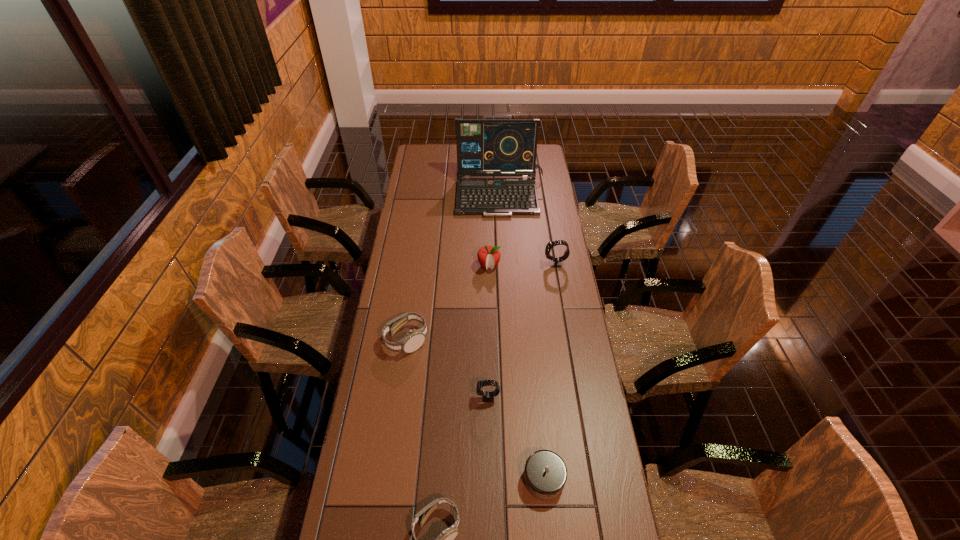
Find the location of a particular element. Image resolution: width=960 pixels, height=540 pixels. the tallest object is located at coordinates (0, 0).

Identify the location of laptop computer. (0, 0).

Locate an element on the screen. The height and width of the screenshot is (540, 960). the biggest gray watch is located at coordinates (0, 0).

At what (x,y) coordinates should I click in order to perform the action: click on the farthest watch. Please return your answer as a coordinate pair (x, y). Looking at the image, I should click on [0, 0].

This screenshot has width=960, height=540. I want to click on the rightmost watch, so click(0, 0).

Where is `the second farthest watch`? the second farthest watch is located at coordinates pos(0,0).

I want to click on apple, so click(x=0, y=0).

Locate an element on the screen. the bigger white watch is located at coordinates (0, 0).

The width and height of the screenshot is (960, 540). In order to click on the leftmost object in this screenshot , I will do `click(0, 0)`.

You are a GUI agent. You are given a task and a screenshot of the screen. Output one action in this format:
    pyautogui.click(x=<x>, y=<y>)
    Task: Click on the chocolate cake
    The width and height of the screenshot is (960, 540).
    Given the screenshot: What is the action you would take?
    pyautogui.click(x=0, y=0)